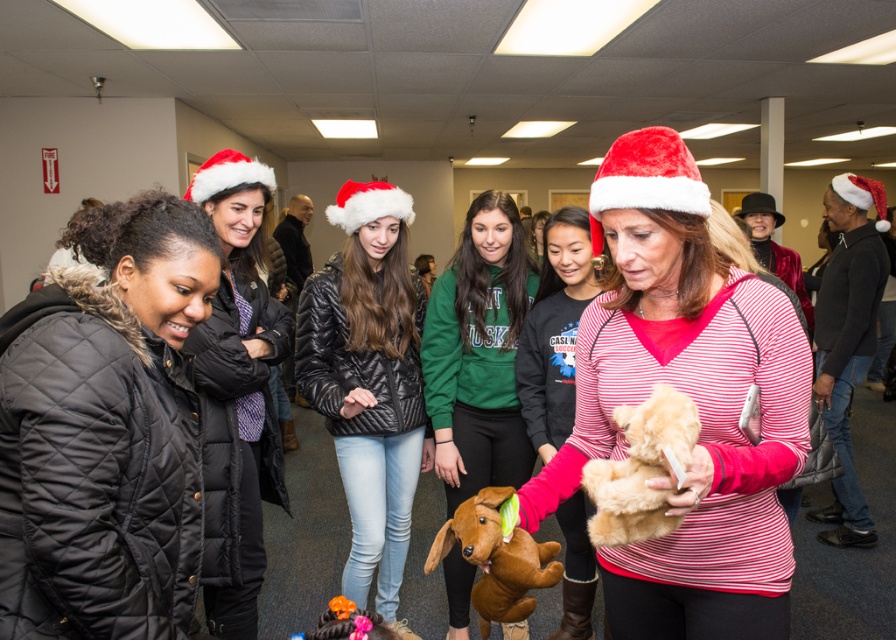
Who is positioned more to the right, velvet red santa hat at center or black quilted jacket at center?

velvet red santa hat at center

Is velvet red santa hat at center taller than black quilted jacket at center?

No, velvet red santa hat at center is not taller than black quilted jacket at center.

Between point (651, 268) and point (394, 276), which one is positioned behind?

Positioned behind is point (394, 276).

This screenshot has height=640, width=896. In order to click on velvet red santa hat at center in this screenshot , I will do `click(688, 396)`.

Does black quilted jacket at center have a greater width compared to velvet plush dog at center?

Yes.

Is black quilted jacket at center shorter than velvet plush dog at center?

No.

The image size is (896, 640). Find the location of `black quilted jacket at center`. black quilted jacket at center is located at coordinates (369, 380).

This screenshot has width=896, height=640. Find the location of `black quilted jacket at center`. black quilted jacket at center is located at coordinates (369, 380).

Who is positioned more to the right, black quilted jacket at center or matte black jacket at left?

From the viewer's perspective, black quilted jacket at center appears more on the right side.

Measure the distance between point (x=360, y=317) and camera.

Point (x=360, y=317) is 2.17 meters from camera.

Where is `black quilted jacket at center`? The image size is (896, 640). black quilted jacket at center is located at coordinates (369, 380).